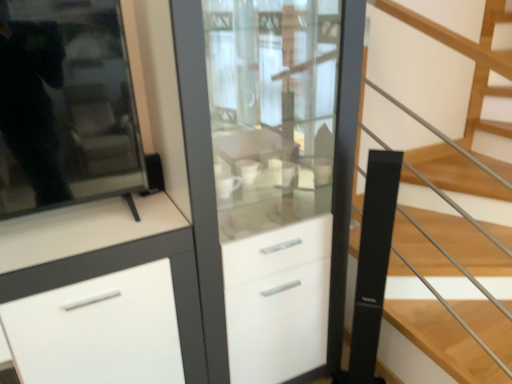
Question: Is white glossy cabinet at center outside of black matte stair at center?

Choices:
 (A) no
 (B) yes

Answer: (B)

Question: From a real-world perspective, is white glossy cabinet at center beneath black matte stair at center?

Choices:
 (A) no
 (B) yes

Answer: (B)

Question: Does white glossy cabinet at center turn towards black matte stair at center?

Choices:
 (A) no
 (B) yes

Answer: (A)

Question: Is white glossy cabinet at center further to the viewer compared to black matte stair at center?

Choices:
 (A) no
 (B) yes

Answer: (B)

Question: Can you see white glossy cabinet at center touching black matte stair at center?

Choices:
 (A) yes
 (B) no

Answer: (B)

Question: From a real-world perspective, is black matte stair at center above or below white matte cabinet at center?

Choices:
 (A) above
 (B) below

Answer: (A)

Question: Considering the positions of black matte stair at center and white matte cabinet at center in the image, is black matte stair at center wider or thinner than white matte cabinet at center?

Choices:
 (A) wide
 (B) thin

Answer: (A)

Question: From the image's perspective, is black matte stair at center located above or below white matte cabinet at center?

Choices:
 (A) below
 (B) above

Answer: (B)

Question: Is black matte stair at center spatially inside white matte cabinet at center, or outside of it?

Choices:
 (A) outside
 (B) inside

Answer: (A)

Question: From the image's perspective, relative to black matte stair at center, is white glossy cabinet at center above or below?

Choices:
 (A) below
 (B) above

Answer: (A)

Question: Considering the positions of white glossy cabinet at center and black matte stair at center in the image, is white glossy cabinet at center wider or thinner than black matte stair at center?

Choices:
 (A) thin
 (B) wide

Answer: (A)

Question: From their relative heights in the image, would you say white glossy cabinet at center is taller or shorter than black matte stair at center?

Choices:
 (A) short
 (B) tall

Answer: (B)

Question: Considering the positions of point (350, 147) and point (425, 243), is point (350, 147) closer or farther from the camera than point (425, 243)?

Choices:
 (A) farther
 (B) closer

Answer: (B)

Question: Considering their positions, is black matte stair at center located in front of or behind white glossy cabinet at center?

Choices:
 (A) behind
 (B) front

Answer: (B)

Question: Is black matte stair at center situated inside white glossy cabinet at center or outside?

Choices:
 (A) inside
 (B) outside

Answer: (B)